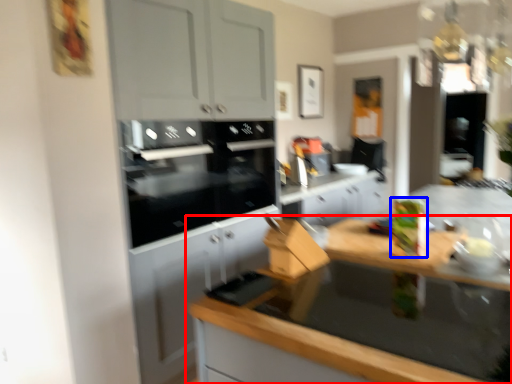
Question: Which of the following is the closest to the observer, countertop (highlighted by a red box) or appliance (highlighted by a blue box)?

Choices:
 (A) countertop
 (B) appliance

Answer: (A)